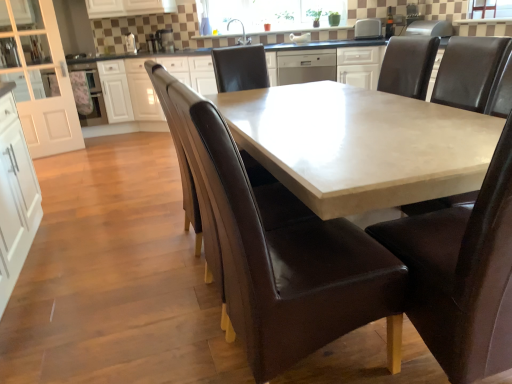
Question: Which direction should I rotate to face satin silver toaster at upper center, which appears as the 2th appliance when viewed from the back, — up or down?

Choices:
 (A) down
 (B) up

Answer: (B)

Question: Would you say satin silver toaster at upper center, which is the 2th appliance in right-to-left order, is outside brown leather chair at center, which appears as the 1th chair when viewed from the left?

Choices:
 (A) no
 (B) yes

Answer: (B)

Question: Is satin silver toaster at upper center, the third appliance viewed from the left, wider than brown leather chair at center, which appears as the 1th chair when viewed from the left?

Choices:
 (A) yes
 (B) no

Answer: (B)

Question: Does satin silver toaster at upper center, which appears as the 2th appliance when viewed from the back, appear on the left side of brown leather chair at center, which appears as the 1th chair when viewed from the left?

Choices:
 (A) yes
 (B) no

Answer: (A)

Question: Is satin silver toaster at upper center, the third appliance viewed from the left, thinner than brown leather chair at center, which appears as the 3th chair when viewed from the right?

Choices:
 (A) yes
 (B) no

Answer: (A)

Question: Can you confirm if satin silver toaster at upper center, which appears as the 2th appliance when viewed from the back, is shorter than brown leather chair at center, which appears as the 3th chair when viewed from the right?

Choices:
 (A) yes
 (B) no

Answer: (A)

Question: Is brown leather chair at center, which appears as the 1th chair when viewed from the left, surrounded by satin silver toaster at upper center, which appears as the 2th appliance when viewed from the back?

Choices:
 (A) no
 (B) yes

Answer: (A)

Question: Is clear glass window screen at upper center, the 2th window screen positioned from the left, facing towards white plastic toaster at upper center, marked as the 1th appliance in a right-to-left arrangement?

Choices:
 (A) yes
 (B) no

Answer: (B)

Question: Does clear glass window screen at upper center, which ranks as the 1th window screen in right-to-left order, have a greater height compared to white plastic toaster at upper center, positioned as the fourth appliance in back-to-front order?

Choices:
 (A) yes
 (B) no

Answer: (B)

Question: Is clear glass window screen at upper center, which is the second window screen in back-to-front order, oriented away from white plastic toaster at upper center, marked as the 1th appliance in a right-to-left arrangement?

Choices:
 (A) yes
 (B) no

Answer: (B)

Question: Is white plastic toaster at upper center, marked as the 1th appliance in a right-to-left arrangement, a part of clear glass window screen at upper center, the 2th window screen positioned from the left?

Choices:
 (A) yes
 (B) no

Answer: (B)

Question: Is clear glass window screen at upper center, which is the 1th window screen in front-to-back order, thinner than white plastic toaster at upper center, positioned as the fourth appliance in back-to-front order?

Choices:
 (A) yes
 (B) no

Answer: (A)

Question: From a real-world perspective, does clear glass window screen at upper center, which is the first window screen from bottom to top, sit lower than white plastic toaster at upper center, marked as the 1th appliance in a right-to-left arrangement?

Choices:
 (A) no
 (B) yes

Answer: (A)

Question: Is brown leather armchair at center far away from brown leather chair at center, acting as the 2th chair starting from the right?

Choices:
 (A) no
 (B) yes

Answer: (A)